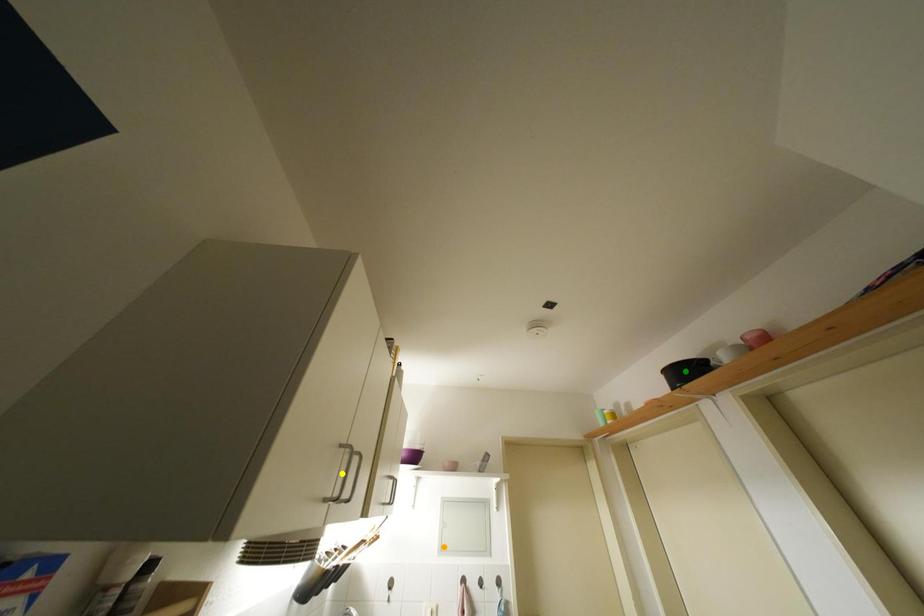
Order these from nearest to farthest:
- yellow point
- orange point
- green point

yellow point, green point, orange point